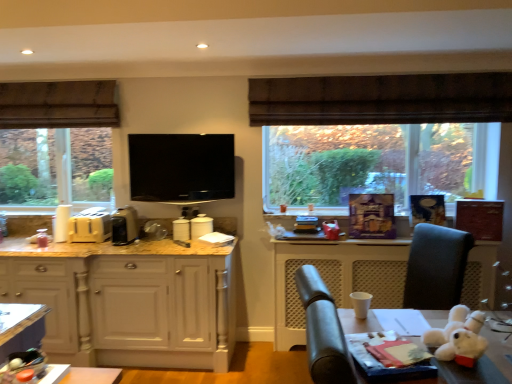
Find the location of a particular element. The width and height of the screenshot is (512, 384). free location to the right of metallic silver coffee machine at left, acting as the second appliance starting from the left is located at coordinates (150, 243).